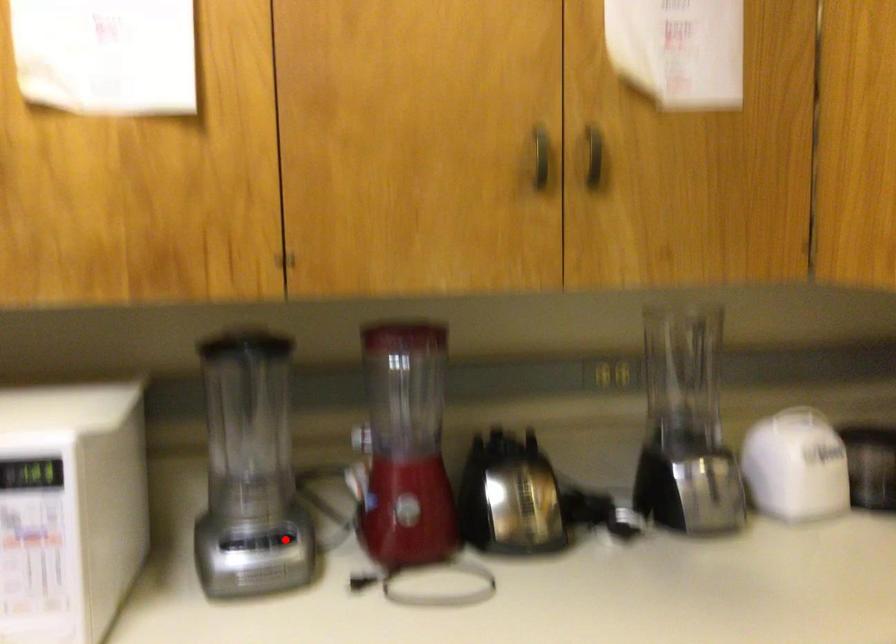
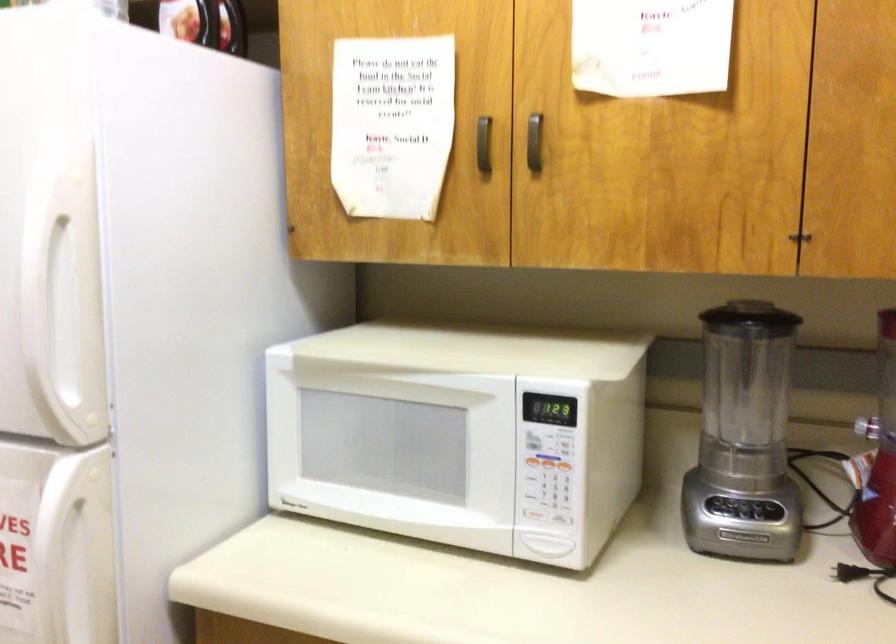
Question: I am providing you with two images of the same scene from different viewpoints. A red point is marked on the first image. At the location where the point appears in image 1, is it still visible in image 2?

Choices:
 (A) Yes
 (B) No

Answer: (A)